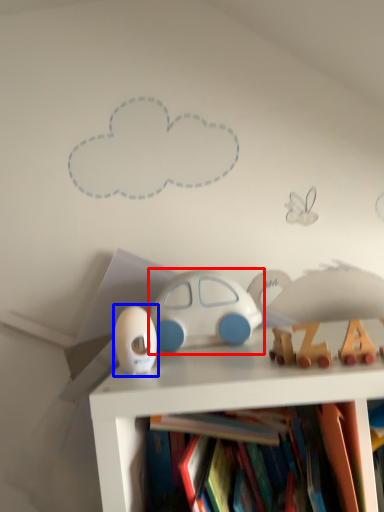
Question: Which of the following is the farthest to the observer, toy (highlighted by a red box) or toy (highlighted by a blue box)?

Choices:
 (A) toy
 (B) toy

Answer: (A)